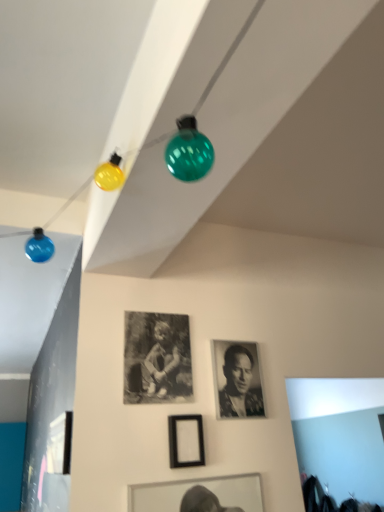
Find the location of a particular element. The height and width of the screenshot is (512, 384). matte black picture frame at lower left, which is the first picture frame in left-to-right order is located at coordinates (60, 444).

Is the surface of black matte picture frame at center, positioned as the 1th picture frame in right-to-left order, in direct contact with black and white photograph at center?

black matte picture frame at center, positioned as the 1th picture frame in right-to-left order, and black and white photograph at center are not in contact.

From the image's perspective, is black matte picture frame at center, positioned as the 1th picture frame in right-to-left order, on top of black and white photograph at center?

No, from the image's perspective, black matte picture frame at center, positioned as the 1th picture frame in right-to-left order, is not on top of black and white photograph at center.

Considering the relative sizes of black matte picture frame at center, positioned as the 1th picture frame in right-to-left order, and black and white photograph at center in the image provided, is black matte picture frame at center, positioned as the 1th picture frame in right-to-left order, taller than black and white photograph at center?

In fact, black matte picture frame at center, positioned as the 1th picture frame in right-to-left order, may be shorter than black and white photograph at center.

Does black matte picture frame at center, arranged as the 3th picture frame when viewed from the left, have a smaller size compared to black and white photograph at center?

Correct, black matte picture frame at center, arranged as the 3th picture frame when viewed from the left, occupies less space than black and white photograph at center.

Is black matte photo frame at center, which is counted as the 2th picture frame, starting from the right, beside matte black picture frame at lower left, which is the first picture frame in left-to-right order?

No, black matte photo frame at center, which is counted as the 2th picture frame, starting from the right, is not with matte black picture frame at lower left, which is the first picture frame in left-to-right order.

Considering the relative sizes of black matte photo frame at center, which is counted as the second picture frame, starting from the left, and matte black picture frame at lower left, which is the first picture frame in left-to-right order, in the image provided, is black matte photo frame at center, which is counted as the second picture frame, starting from the left, bigger than matte black picture frame at lower left, which is the first picture frame in left-to-right order,?

Actually, black matte photo frame at center, which is counted as the second picture frame, starting from the left, might be smaller than matte black picture frame at lower left, which is the first picture frame in left-to-right order.

Is black matte photo frame at center, which is counted as the 2th picture frame, starting from the right, oriented away from matte black picture frame at lower left, marked as the 3th picture frame in a right-to-left arrangement?

That's not correct — black matte photo frame at center, which is counted as the 2th picture frame, starting from the right, is not looking away from matte black picture frame at lower left, marked as the 3th picture frame in a right-to-left arrangement.

What's the angular difference between black matte photo frame at center, which is counted as the second picture frame, starting from the left, and black matte picture frame at center, arranged as the 3th picture frame when viewed from the left,'s facing directions?

The angle between the facing direction of black matte photo frame at center, which is counted as the second picture frame, starting from the left, and the facing direction of black matte picture frame at center, arranged as the 3th picture frame when viewed from the left, is 0.0445 degrees.

The height and width of the screenshot is (512, 384). In order to click on picture frame to the right of black matte photo frame at center, which is counted as the 2th picture frame, starting from the right in this screenshot , I will do `click(186, 441)`.

From the image's perspective, is black matte photo frame at center, which is counted as the 2th picture frame, starting from the right, on top of black matte picture frame at center, arranged as the 3th picture frame when viewed from the left?

Yes, from the image's perspective, black matte photo frame at center, which is counted as the 2th picture frame, starting from the right, is over black matte picture frame at center, arranged as the 3th picture frame when viewed from the left.

Could you tell me if black matte photo frame at center, which is counted as the second picture frame, starting from the left, is facing black matte picture frame at center, arranged as the 3th picture frame when viewed from the left?

No, black matte photo frame at center, which is counted as the second picture frame, starting from the left, is not facing towards black matte picture frame at center, arranged as the 3th picture frame when viewed from the left.

Looking at their sizes, would you say black matte picture frame at center, arranged as the 3th picture frame when viewed from the left, is wider or thinner than black matte photo frame at center, which is counted as the 2th picture frame, starting from the right?

In the image, black matte picture frame at center, arranged as the 3th picture frame when viewed from the left, appears to be wider than black matte photo frame at center, which is counted as the 2th picture frame, starting from the right.

Which is more to the right, black matte picture frame at center, positioned as the 1th picture frame in right-to-left order, or black matte photo frame at center, which is counted as the second picture frame, starting from the left?

black matte picture frame at center, positioned as the 1th picture frame in right-to-left order, is more to the right.

Is point (176, 459) less distant than point (179, 389)?

Yes, point (176, 459) is in front of point (179, 389).

How many degrees apart are the facing directions of black matte picture frame at center, arranged as the 3th picture frame when viewed from the left, and black matte photo frame at center, which is counted as the second picture frame, starting from the left?

0.0445 degrees.

Does black and white photograph at center come in front of black matte photo frame at center, which is counted as the second picture frame, starting from the left?

No.

Is black and white photograph at center at the right side of black matte photo frame at center, which is counted as the second picture frame, starting from the left?

Indeed, black and white photograph at center is positioned on the right side of black matte photo frame at center, which is counted as the second picture frame, starting from the left.

Is black and white photograph at center thinner than black matte photo frame at center, which is counted as the 2th picture frame, starting from the right?

No.

How distant is black and white photograph at center from black matte photo frame at center, which is counted as the second picture frame, starting from the left?

black and white photograph at center is 10.23 inches from black matte photo frame at center, which is counted as the second picture frame, starting from the left.

Image resolution: width=384 pixels, height=512 pixels. I want to click on picture frame that is the 2nd object located in front of the black matte photo frame at center, which is counted as the second picture frame, starting from the left, so click(60, 444).

Is matte black picture frame at lower left, marked as the 3th picture frame in a right-to-left arrangement, oriented towards black matte photo frame at center, which is counted as the 2th picture frame, starting from the right?

No, matte black picture frame at lower left, marked as the 3th picture frame in a right-to-left arrangement, is not aimed at black matte photo frame at center, which is counted as the 2th picture frame, starting from the right.

Is point (60, 443) positioned in front of point (160, 343)?

Yes, point (60, 443) is in front of point (160, 343).

From the image's perspective, which is above, matte black picture frame at lower left, marked as the 3th picture frame in a right-to-left arrangement, or black and white photograph at center?

black and white photograph at center, from the image's perspective.

Is matte black picture frame at lower left, marked as the 3th picture frame in a right-to-left arrangement, bigger than black and white photograph at center?

Correct, matte black picture frame at lower left, marked as the 3th picture frame in a right-to-left arrangement, is larger in size than black and white photograph at center.

How distant is matte black picture frame at lower left, marked as the 3th picture frame in a right-to-left arrangement, from black and white photograph at center?

The distance of matte black picture frame at lower left, marked as the 3th picture frame in a right-to-left arrangement, from black and white photograph at center is 25.62 inches.

Is matte black picture frame at lower left, which is the first picture frame in left-to-right order, taller or shorter than black and white photograph at center?

Considering their sizes, matte black picture frame at lower left, which is the first picture frame in left-to-right order, has less height than black and white photograph at center.

This screenshot has height=512, width=384. I want to click on the 1st picture frame to the left of the black and white photograph at center, starting your count from the anchor, so click(186, 441).

This screenshot has width=384, height=512. I want to click on picture frame that is the 2nd object located below the black matte photo frame at center, which is counted as the second picture frame, starting from the left (from the image's perspective), so click(60, 444).

Estimate the real-world distances between objects in this image. Which object is further from black matte photo frame at center, which is counted as the 2th picture frame, starting from the right, matte black picture frame at lower left, marked as the 3th picture frame in a right-to-left arrangement, or black and white photograph at center?

The object further to black matte photo frame at center, which is counted as the 2th picture frame, starting from the right, is matte black picture frame at lower left, marked as the 3th picture frame in a right-to-left arrangement.

Looking at the image, which one is located further to matte black picture frame at lower left, marked as the 3th picture frame in a right-to-left arrangement, black matte picture frame at center, positioned as the 1th picture frame in right-to-left order, or black and white photograph at center?

black and white photograph at center is further to matte black picture frame at lower left, marked as the 3th picture frame in a right-to-left arrangement.

When comparing their distances from black and white photograph at center, does black matte picture frame at center, arranged as the 3th picture frame when viewed from the left, or matte black picture frame at lower left, which is the first picture frame in left-to-right order, seem further?

Among the two, matte black picture frame at lower left, which is the first picture frame in left-to-right order, is located further to black and white photograph at center.

Estimate the real-world distances between objects in this image. Which object is further from black matte picture frame at center, positioned as the 1th picture frame in right-to-left order, matte black picture frame at lower left, marked as the 3th picture frame in a right-to-left arrangement, or black and white photograph at center?

matte black picture frame at lower left, marked as the 3th picture frame in a right-to-left arrangement, is further to black matte picture frame at center, positioned as the 1th picture frame in right-to-left order.

Consider the image. When comparing their distances from black matte photo frame at center, which is counted as the 2th picture frame, starting from the right, does black and white photograph at center or black matte picture frame at center, arranged as the 3th picture frame when viewed from the left, seem closer?

black matte picture frame at center, arranged as the 3th picture frame when viewed from the left, is closer to black matte photo frame at center, which is counted as the 2th picture frame, starting from the right.

From the image, which object appears to be nearer to black and white photograph at center, matte black picture frame at lower left, which is the first picture frame in left-to-right order, or black matte picture frame at center, positioned as the 1th picture frame in right-to-left order?

The object closer to black and white photograph at center is black matte picture frame at center, positioned as the 1th picture frame in right-to-left order.

Looking at the image, which one is located further to black and white photograph at center, matte black picture frame at lower left, marked as the 3th picture frame in a right-to-left arrangement, or black matte photo frame at center, which is counted as the 2th picture frame, starting from the right?

matte black picture frame at lower left, marked as the 3th picture frame in a right-to-left arrangement, is further to black and white photograph at center.

Which object lies further to the anchor point black matte photo frame at center, which is counted as the second picture frame, starting from the left, black and white photograph at center or matte black picture frame at lower left, marked as the 3th picture frame in a right-to-left arrangement?

matte black picture frame at lower left, marked as the 3th picture frame in a right-to-left arrangement, is further to black matte photo frame at center, which is counted as the second picture frame, starting from the left.

I want to click on picture frame located between matte black picture frame at lower left, marked as the 3th picture frame in a right-to-left arrangement, and black matte picture frame at center, positioned as the 1th picture frame in right-to-left order, in the left-right direction, so click(157, 358).

The width and height of the screenshot is (384, 512). Find the location of `picture frame between black matte photo frame at center, which is counted as the second picture frame, starting from the left, and black and white photograph at center, in the horizontal direction`. picture frame between black matte photo frame at center, which is counted as the second picture frame, starting from the left, and black and white photograph at center, in the horizontal direction is located at coordinates (186, 441).